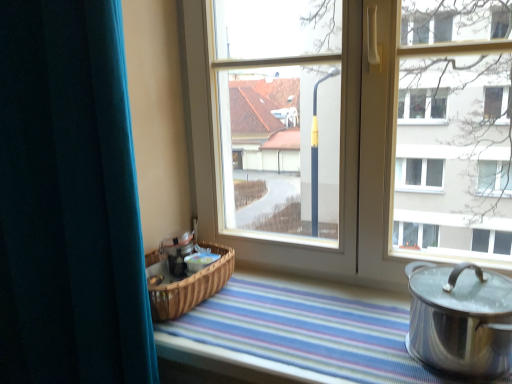
Question: Is teal velvet curtain at left to the right of polished silver pot at lower right from the viewer's perspective?

Choices:
 (A) yes
 (B) no

Answer: (B)

Question: From a real-world perspective, is teal velvet curtain at left positioned over polished silver pot at lower right based on gravity?

Choices:
 (A) yes
 (B) no

Answer: (A)

Question: From the image's perspective, is teal velvet curtain at left over polished silver pot at lower right?

Choices:
 (A) yes
 (B) no

Answer: (A)

Question: From the image's perspective, is teal velvet curtain at left beneath polished silver pot at lower right?

Choices:
 (A) no
 (B) yes

Answer: (A)

Question: Can you confirm if teal velvet curtain at left is bigger than polished silver pot at lower right?

Choices:
 (A) yes
 (B) no

Answer: (A)

Question: Based on their sizes in the image, would you say polished silver pot at lower right is bigger or smaller than teal velvet curtain at left?

Choices:
 (A) small
 (B) big

Answer: (A)

Question: In terms of width, does polished silver pot at lower right look wider or thinner when compared to teal velvet curtain at left?

Choices:
 (A) thin
 (B) wide

Answer: (B)

Question: Is polished silver pot at lower right taller or shorter than teal velvet curtain at left?

Choices:
 (A) tall
 (B) short

Answer: (B)

Question: Relative to teal velvet curtain at left, is polished silver pot at lower right in front or behind?

Choices:
 (A) front
 (B) behind

Answer: (B)

Question: Is transparent glass window at center wider or thinner than polished silver pot at lower right?

Choices:
 (A) thin
 (B) wide

Answer: (A)

Question: From a real-world perspective, is transparent glass window at center positioned above or below polished silver pot at lower right?

Choices:
 (A) below
 (B) above

Answer: (B)

Question: Is transparent glass window at center in front of or behind polished silver pot at lower right in the image?

Choices:
 (A) front
 (B) behind

Answer: (B)

Question: Is transparent glass window at center spatially inside polished silver pot at lower right, or outside of it?

Choices:
 (A) outside
 (B) inside

Answer: (A)

Question: Is polished silver pot at lower right inside or outside of transparent glass window at center?

Choices:
 (A) outside
 (B) inside

Answer: (A)

Question: Based on their sizes in the image, would you say polished silver pot at lower right is bigger or smaller than transparent glass window at center?

Choices:
 (A) small
 (B) big

Answer: (A)